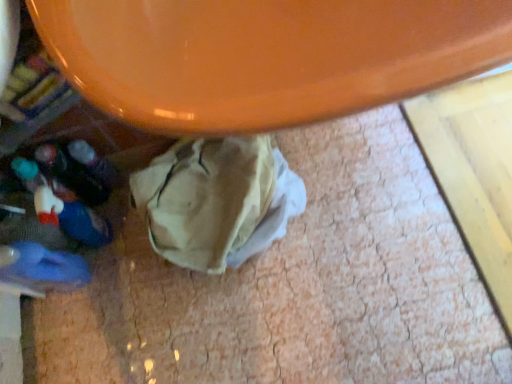
Locate an element on the screen. free point below orange glossy table at upper center (from a real-world perspective) is located at coordinates (331, 211).